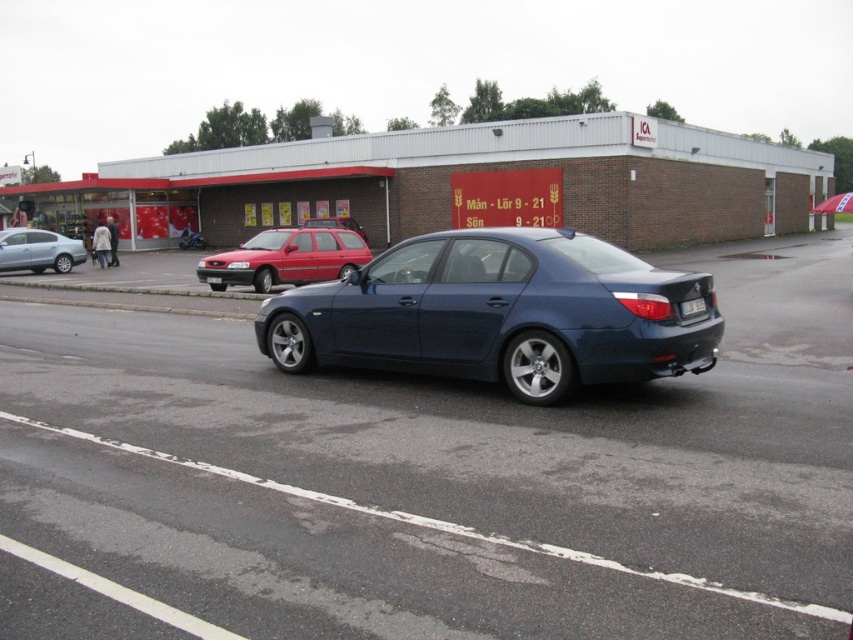
Question: Among these objects, which one is farthest from the camera?

Choices:
 (A) white plastic license plate at rear
 (B) satin silver sedan at left
 (C) brick building at center
 (D) white plastic license plate at center

Answer: (C)

Question: Is white plastic license plate at rear further to the viewer compared to white plastic license plate at center?

Choices:
 (A) yes
 (B) no

Answer: (B)

Question: Observing the image, what is the correct spatial positioning of metallic blue car at center in reference to brick building at center?

Choices:
 (A) below
 (B) above

Answer: (A)

Question: Which point appears closest to the camera in this image?

Choices:
 (A) (236, 266)
 (B) (199, 573)
 (C) (80, 244)
 (D) (312, 273)

Answer: (B)

Question: Which object appears closest to the camera in this image?

Choices:
 (A) metallic blue car at center
 (B) satin silver sedan at left
 (C) satin blue sedan at center
 (D) white plastic license plate at center

Answer: (A)

Question: Where is matte red station wagon at center located in relation to white plastic license plate at rear in the image?

Choices:
 (A) right
 (B) left

Answer: (B)